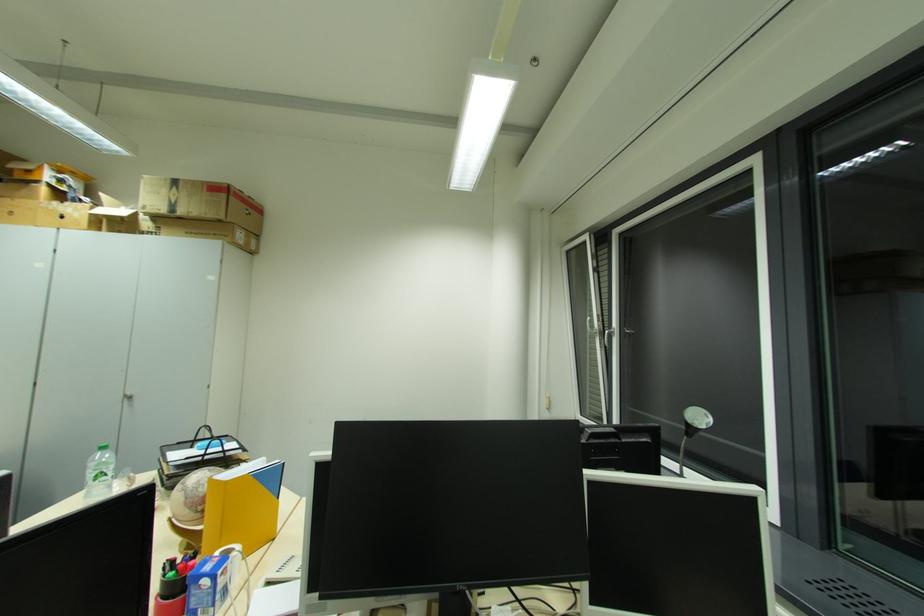
Find where to pull the window handle. Please return your answer as a coordinate pair (x, y).

(592, 330)